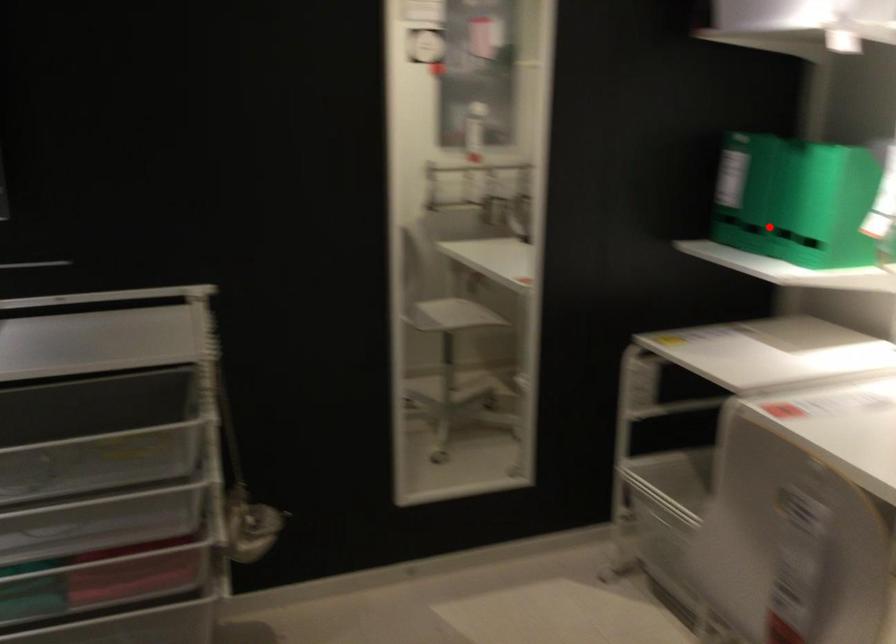
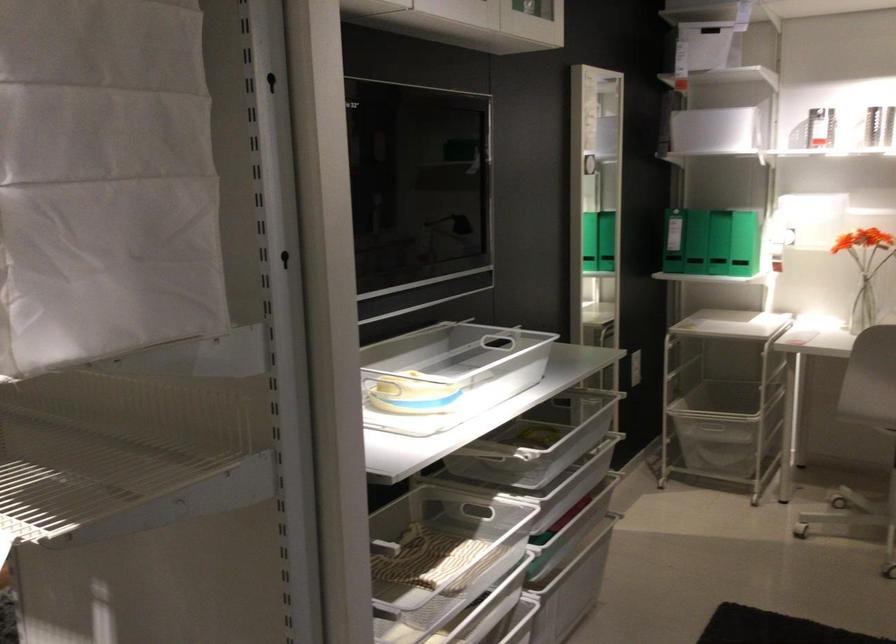
Find the pixel in the second image that matches the highlighted location in the first image.

(745, 243)